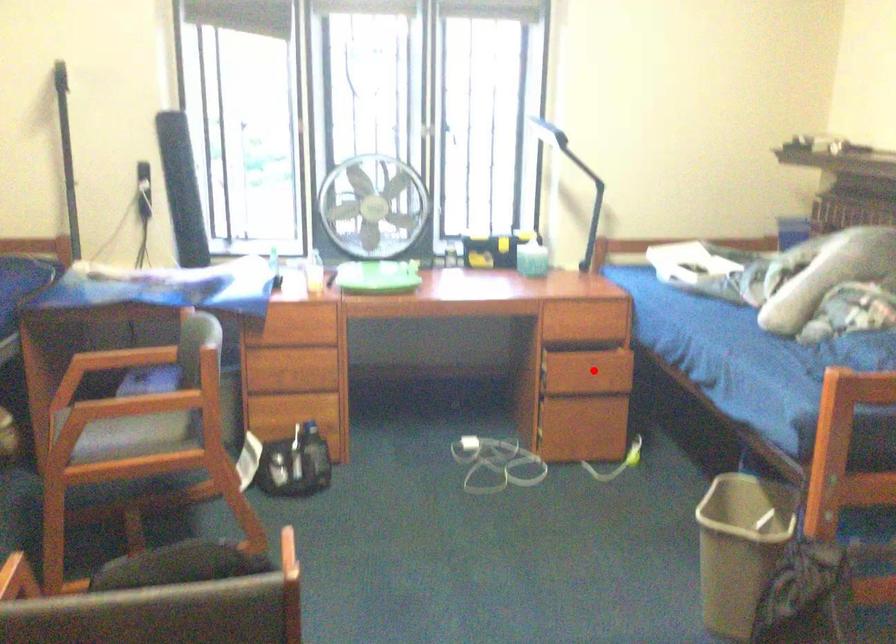
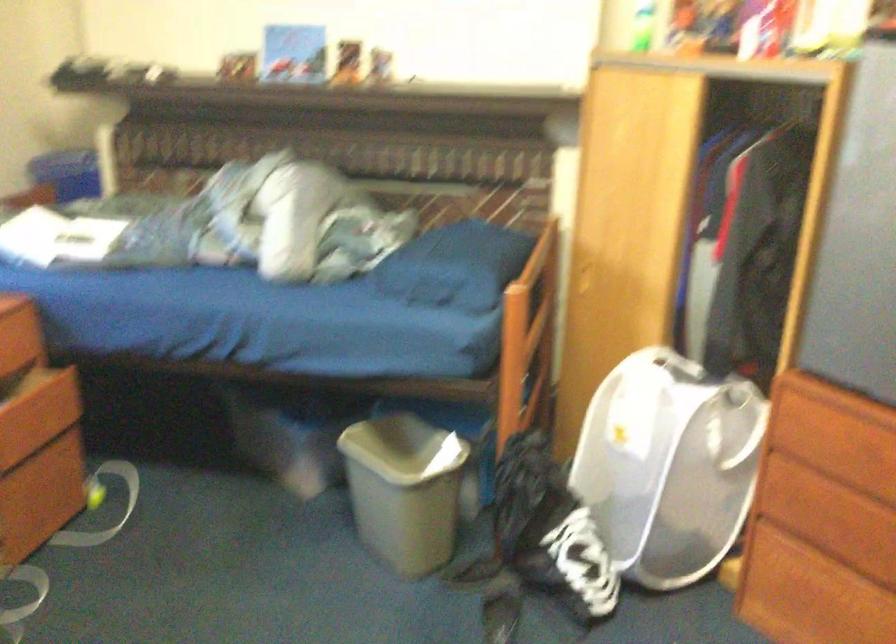
The point at the highlighted location is marked in the first image. Where is the corresponding point in the second image?

(39, 413)